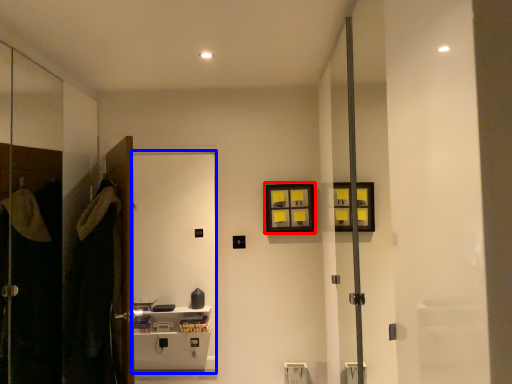
Question: Which of the following is the closest to the observer, picture frame (highlighted by a red box) or screen door (highlighted by a blue box)?

Choices:
 (A) picture frame
 (B) screen door

Answer: (B)